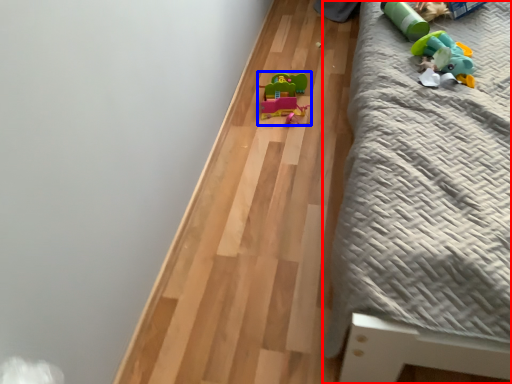
Question: Among these objects, which one is nearest to the camera, furniture (highlighted by a red box) or toy (highlighted by a blue box)?

Choices:
 (A) furniture
 (B) toy

Answer: (A)